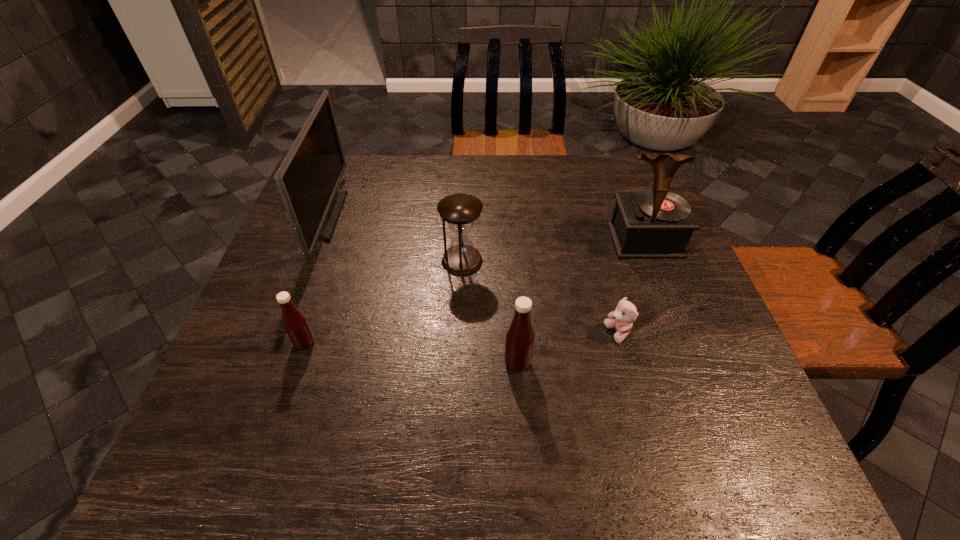
Locate an element on the screen. The image size is (960, 540). vacant spot to place a Tabasco sauce on the right is located at coordinates (747, 384).